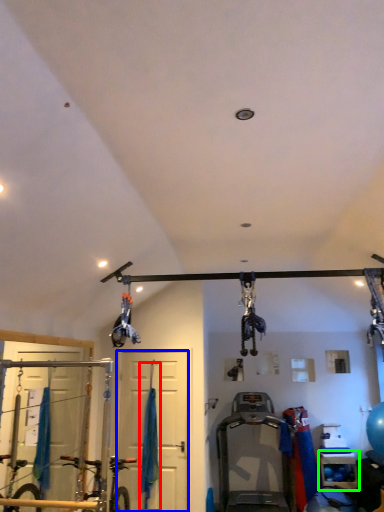
Question: Which is farther away from curtain (highlighted by a red box)? door (highlighted by a blue box) or shelf (highlighted by a green box)?

Choices:
 (A) door
 (B) shelf

Answer: (B)